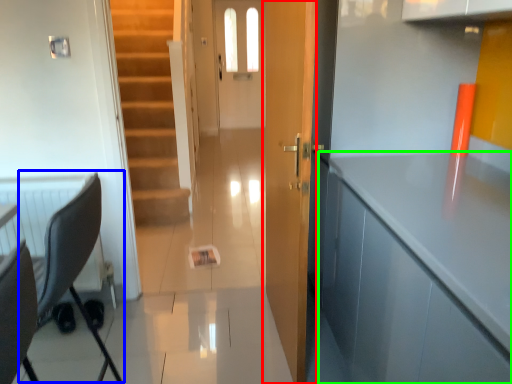
Question: Based on their relative distances, which object is nearer to door (highlighted by a red box)? Choose from swivel chair (highlighted by a blue box) and cabinetry (highlighted by a green box).

Choices:
 (A) swivel chair
 (B) cabinetry

Answer: (B)